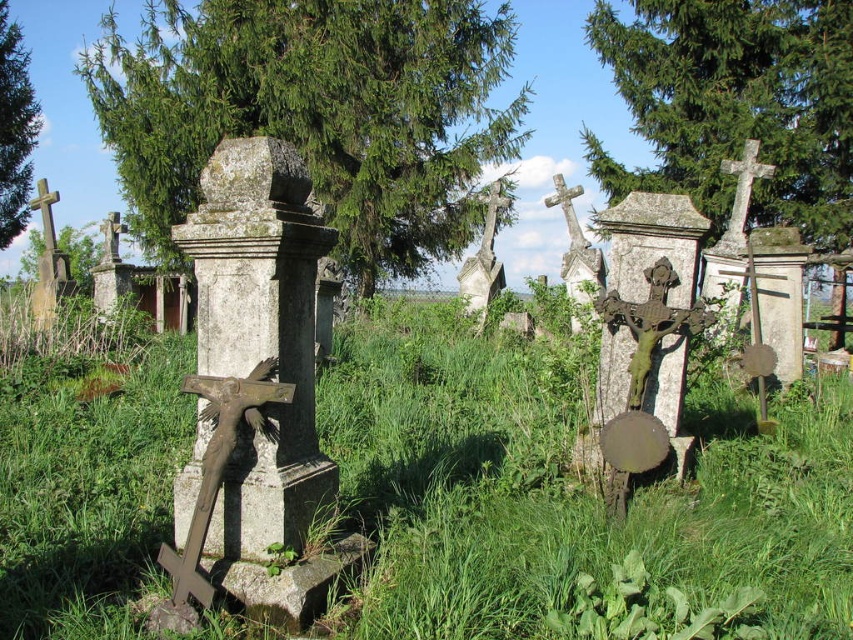
Describe the element at coordinates (315, 113) in the screenshot. This screenshot has height=640, width=853. I see `green leafy tree at center` at that location.

Which is more to the right, green leafy tree at center or green leafy tree at upper center?

Positioned to the right is green leafy tree at upper center.

Is point (91, 68) farther from camera compared to point (669, 141)?

That is True.

Locate an element on the screen. The width and height of the screenshot is (853, 640). green leafy tree at center is located at coordinates (315, 113).

Who is more forward, (822,83) or (86,228)?

Point (822,83) is in front.

Describe the element at coordinates (735, 104) in the screenshot. This screenshot has height=640, width=853. I see `green leafy tree at upper center` at that location.

Measure the distance between green leafy tree at upper center and camera.

They are 12.84 meters apart.

This screenshot has width=853, height=640. What are the coordinates of `green leafy tree at upper center` in the screenshot? It's located at (735, 104).

Between green grassy at center and green leafy tree at center, which one appears on the left side from the viewer's perspective?

From the viewer's perspective, green leafy tree at center appears more on the left side.

This screenshot has height=640, width=853. What do you see at coordinates (567, 492) in the screenshot?
I see `green grassy at center` at bounding box center [567, 492].

Where is `green grassy at center`? green grassy at center is located at coordinates (567, 492).